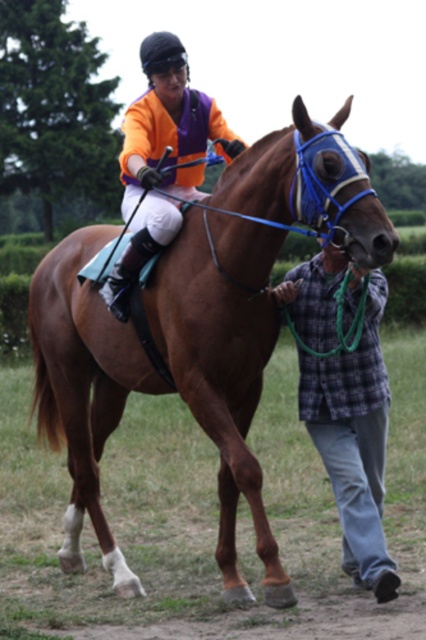
Question: Which point is farther to the camera?

Choices:
 (A) [169, 65]
 (B) [92, 339]

Answer: (A)

Question: Is brown glossy horse at center thinner than orange jersey at center?

Choices:
 (A) yes
 (B) no

Answer: (B)

Question: Based on their relative distances, which object is nearer to the plaid flannel shirt at lower right?

Choices:
 (A) orange jersey at center
 (B) brown glossy horse at center

Answer: (B)

Question: Which of the following is the farthest from the observer?

Choices:
 (A) (x=281, y=600)
 (B) (x=166, y=198)

Answer: (B)

Question: Can you confirm if plaid flannel shirt at lower right is bigger than orange jersey at center?

Choices:
 (A) no
 (B) yes

Answer: (A)

Question: In this image, where is brown glossy horse at center located relative to plaid flannel shirt at lower right?

Choices:
 (A) left
 (B) right

Answer: (A)